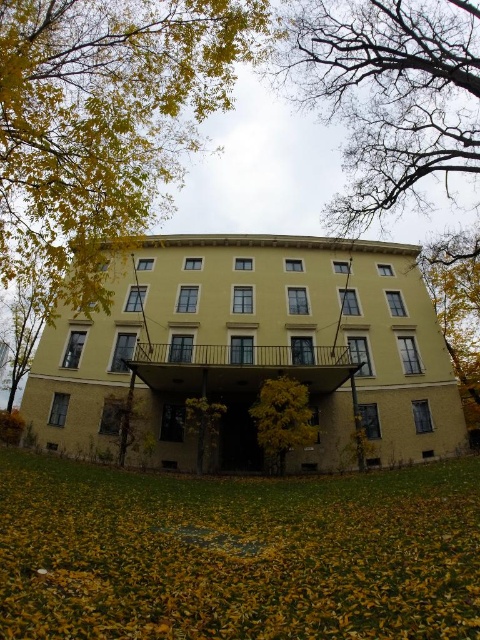
Does yellow leaf litter at lower center have a lesser height compared to bare branches at upper center?

Correct, yellow leaf litter at lower center is not as tall as bare branches at upper center.

Does yellow leaf litter at lower center have a greater width compared to bare branches at upper center?

In fact, yellow leaf litter at lower center might be narrower than bare branches at upper center.

Identify the location of yellow leaf litter at lower center. The width and height of the screenshot is (480, 640). (237, 554).

Is yellow leaf litter at lower center thinner than yellow leafy tree at upper left?

Correct, yellow leaf litter at lower center's width is less than yellow leafy tree at upper left's.

Does yellow leaf litter at lower center appear on the left side of yellow leafy tree at upper left?

Result: No, yellow leaf litter at lower center is not to the left of yellow leafy tree at upper left.

What do you see at coordinates (237, 554) in the screenshot? I see `yellow leaf litter at lower center` at bounding box center [237, 554].

The width and height of the screenshot is (480, 640). Identify the location of yellow leaf litter at lower center. (237, 554).

Does yellow leaf litter at lower center appear on the left side of yellow-green foliage at center?

Yes, yellow leaf litter at lower center is to the left of yellow-green foliage at center.

Does point (129, 570) lie behind point (257, 410)?

No, (129, 570) is in front of (257, 410).

In order to click on yellow leaf litter at lower center in this screenshot , I will do `click(237, 554)`.